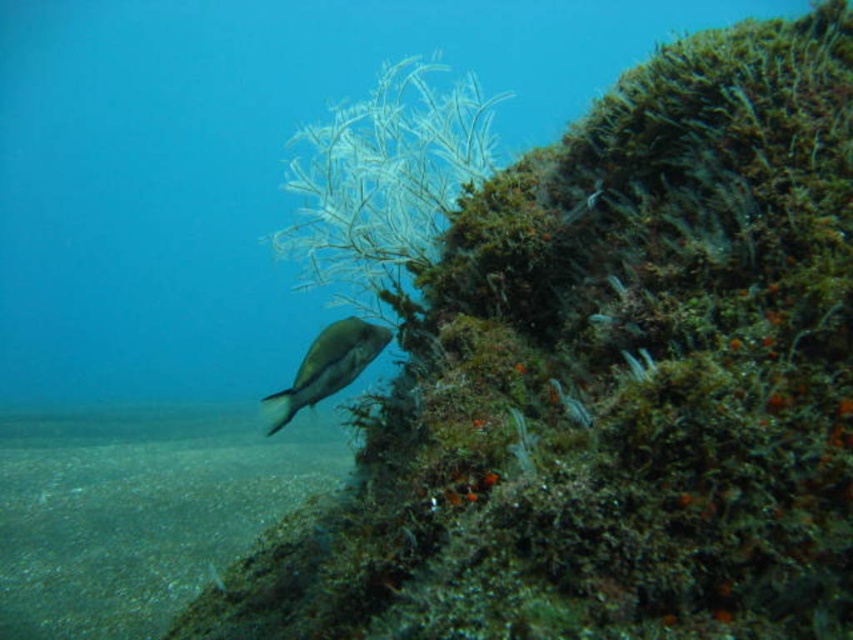
Between clear water at bottom and shiny silver fish at center, which one is positioned lower?

Positioned lower is clear water at bottom.

Does clear water at bottom have a lesser width compared to shiny silver fish at center?

Incorrect, clear water at bottom's width is not less than shiny silver fish at center's.

Is point (149, 577) more distant than point (282, 394)?

That is True.

Image resolution: width=853 pixels, height=640 pixels. I want to click on clear water at bottom, so click(138, 509).